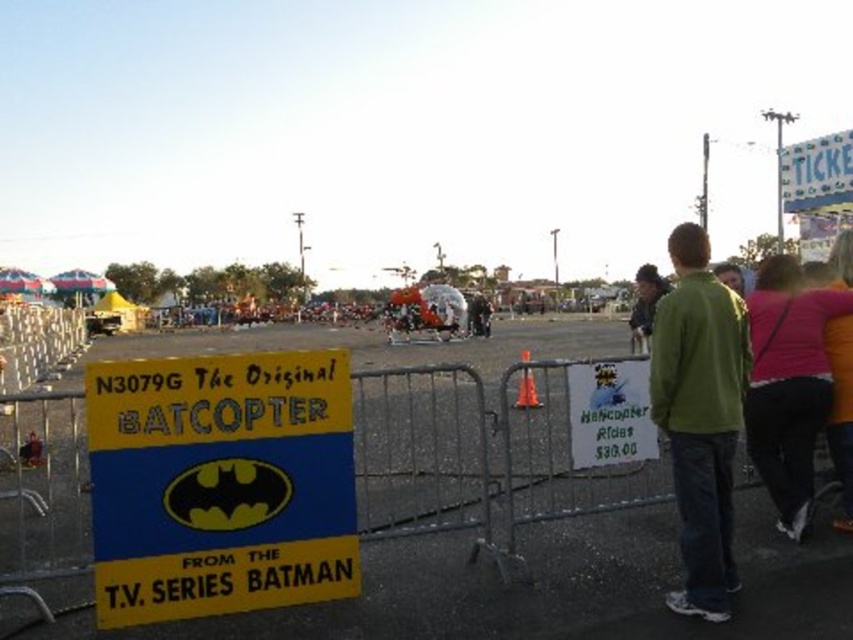
You are at the carnival and see a pink fabric shirt at right and a green cotton hoodie at center. Which clothing item is closer to you?

The pink fabric shirt at right is closer to you because it is in front of the green cotton hoodie at center.

You are at a fair and see the green fleece jacket at center. Where exactly is it located?

The green fleece jacket at center is located at point (x=700, y=417).